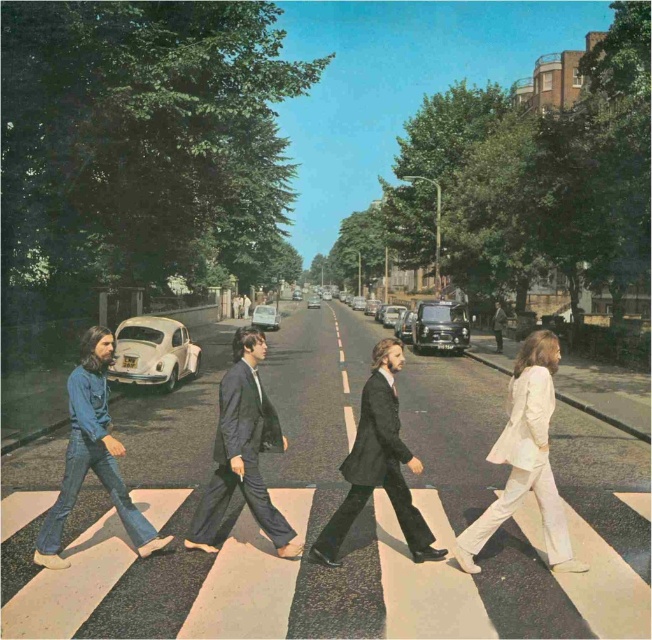
I want to click on denim jeans at center, so click(93, 456).

Does point (70, 496) lie behind point (505, 324)?

No.

What do you see at coordinates (93, 456) in the screenshot? This screenshot has width=652, height=640. I see `denim jeans at center` at bounding box center [93, 456].

You are a GUI agent. You are given a task and a screenshot of the screen. Output one action in this format:
    pyautogui.click(x=<x>, y=<y>)
    Task: Click on the denim jeans at center
    The image size is (652, 640).
    Given the screenshot: What is the action you would take?
    pyautogui.click(x=93, y=456)

Between dark blue suit at center and light brown leather jacket at center, which one appears on the left side from the viewer's perspective?

dark blue suit at center

Who is lower down, dark blue suit at center or light brown leather jacket at center?

dark blue suit at center is below.

What do you see at coordinates (243, 451) in the screenshot? Image resolution: width=652 pixels, height=640 pixels. I see `dark blue suit at center` at bounding box center [243, 451].

The image size is (652, 640). Identify the location of dark blue suit at center. (243, 451).

Is the position of dark gray suit at center more distant than that of denim jeans at center?

No.

Between dark gray suit at center and denim jeans at center, which one is positioned lower?

dark gray suit at center is lower down.

This screenshot has height=640, width=652. What do you see at coordinates (378, 465) in the screenshot?
I see `dark gray suit at center` at bounding box center [378, 465].

You are a GUI agent. You are given a task and a screenshot of the screen. Output one action in this format:
    pyautogui.click(x=<x>, y=<y>)
    Task: Click on the dark gray suit at center
    Image resolution: width=652 pixels, height=640 pixels.
    Given the screenshot: What is the action you would take?
    pyautogui.click(x=378, y=465)